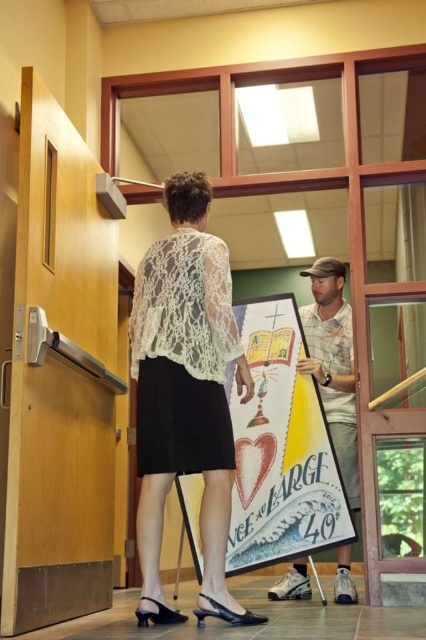
Question: Is white lace blouse at center positioned in front of matte paper poster at center?

Choices:
 (A) no
 (B) yes

Answer: (B)

Question: Which point is farther to the camera?

Choices:
 (A) (169, 397)
 (B) (354, 410)

Answer: (B)

Question: In this image, where is matte paper poster at center located relative to camouflage fabric shirt at center?

Choices:
 (A) below
 (B) above

Answer: (B)

Question: Which object is the closest to the camouflage fabric shirt at center?

Choices:
 (A) white lace blouse at center
 (B) matte paper poster at center

Answer: (B)

Question: Does white lace blouse at center appear over matte paper poster at center?

Choices:
 (A) yes
 (B) no

Answer: (A)

Question: Which object is positioned closest to the camouflage fabric shirt at center?

Choices:
 (A) matte paper poster at center
 (B) white lace blouse at center

Answer: (A)